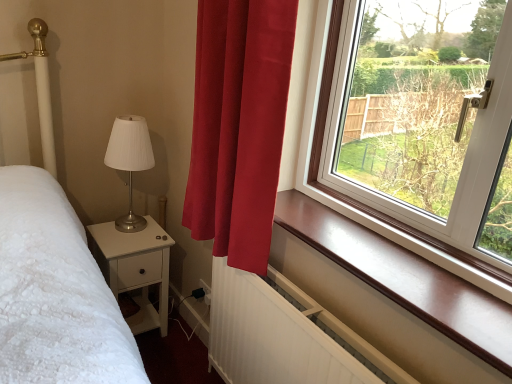
Locate an element on the screen. This screenshot has width=512, height=384. free point below matte silver table lamp at left (from a real-world perspective) is located at coordinates (125, 226).